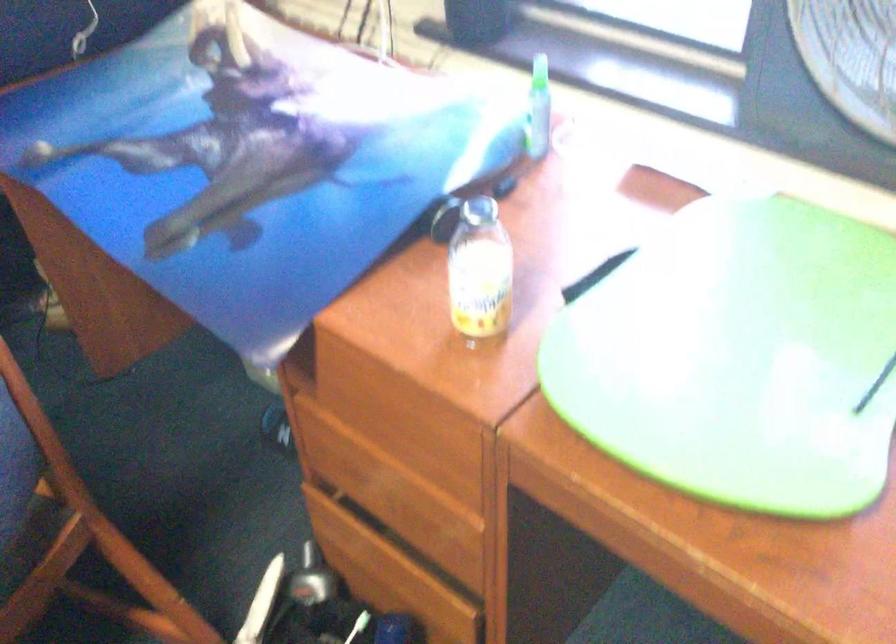
Find where to lift the small plastic bottle. Please return your answer as a coordinate pair (x, y).

(479, 270)